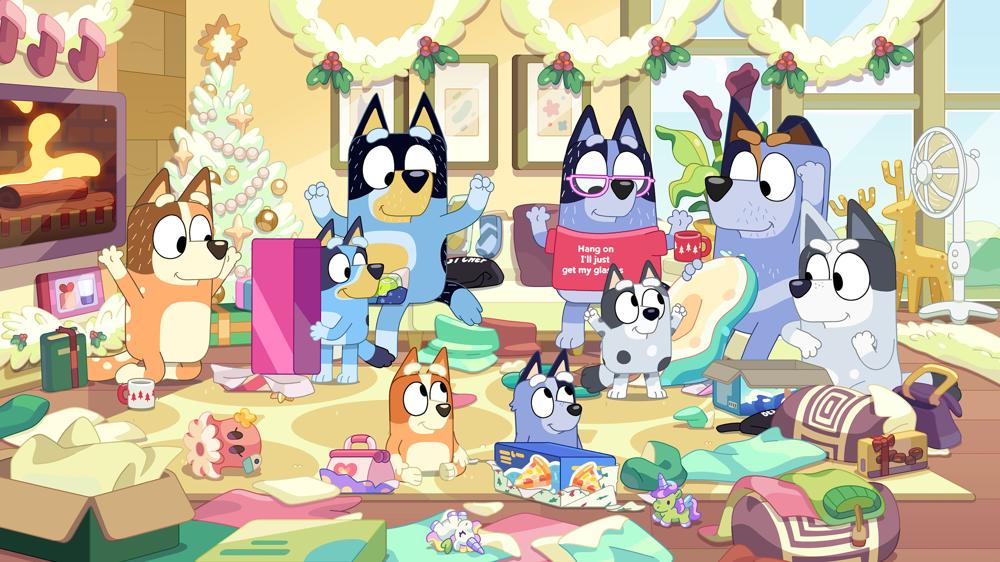
The height and width of the screenshot is (562, 1000). What are the coordinates of `toy` in the screenshot? It's located at (222, 448), (360, 469), (454, 529), (571, 472), (674, 500), (889, 446).